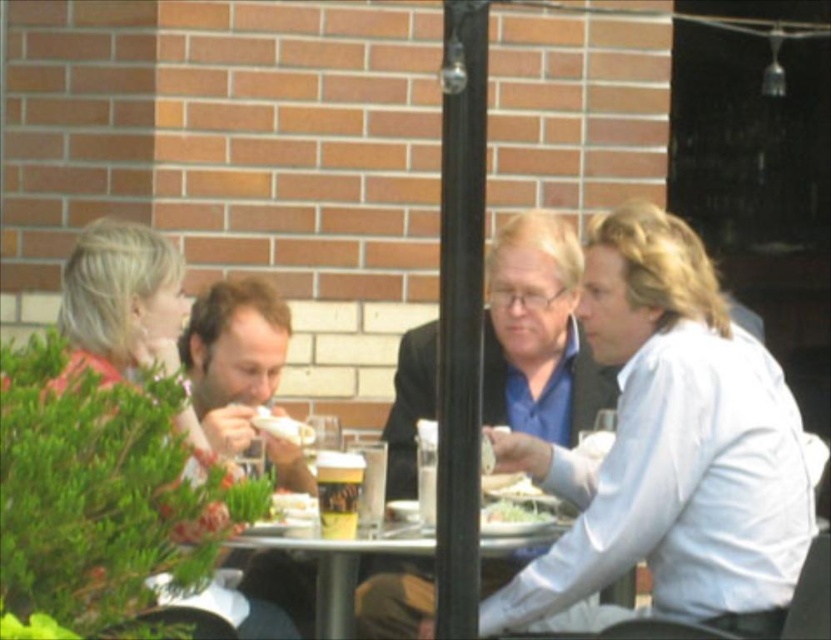
Question: Which point is farther to the camera?

Choices:
 (A) light blue shirt at center
 (B) blue matte shirt at center
 (C) white paper sandwich at center
 (D) translucent plastic cup at center

Answer: (B)

Question: Can you confirm if brown hair at center is positioned to the right of translucent plastic cup at center?

Choices:
 (A) no
 (B) yes

Answer: (A)

Question: Does brown hair at center have a larger size compared to translucent plastic cup at center?

Choices:
 (A) no
 (B) yes

Answer: (B)

Question: Considering the real-world distances, which object is farthest from the light blue shirt at center?

Choices:
 (A) brown hair at center
 (B) metallic silver table at center

Answer: (A)

Question: Among these points, which one is farthest from the camera?

Choices:
 (A) (205, 390)
 (B) (498, 513)
 (C) (273, 557)
 (D) (327, 456)

Answer: (C)

Question: In this image, where is light blue shirt at center located relative to blonde hair at left?

Choices:
 (A) left
 (B) right

Answer: (B)